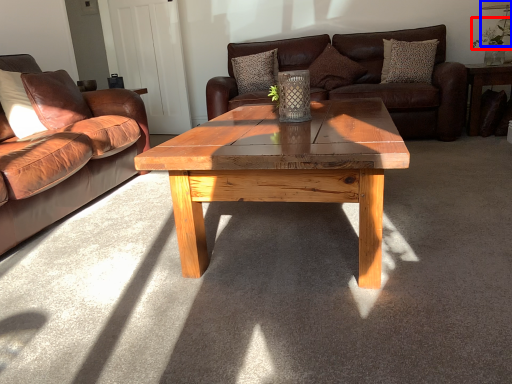
Question: Which object is further to the camera taking this photo, floral arrangement (highlighted by a red box) or lamp (highlighted by a blue box)?

Choices:
 (A) floral arrangement
 (B) lamp

Answer: (B)